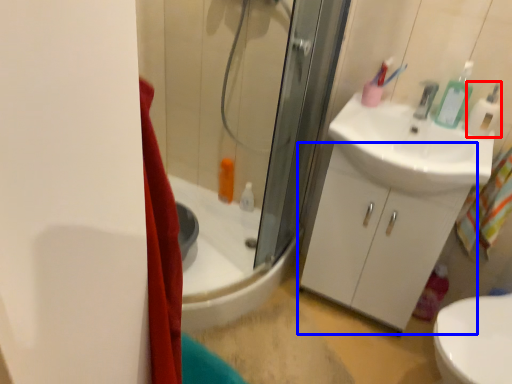
Question: Among these objects, which one is farthest to the camera, soap dispenser (highlighted by a red box) or bathroom cabinet (highlighted by a blue box)?

Choices:
 (A) soap dispenser
 (B) bathroom cabinet

Answer: (B)